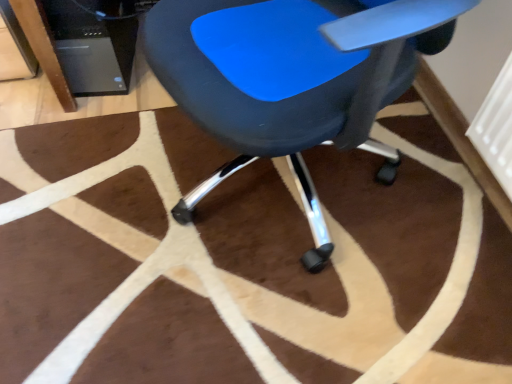
Find the location of a particular element. The height and width of the screenshot is (384, 512). blue plastic chair at center is located at coordinates (274, 86).

Identify the location of black plastic computer tower at upper left. The width and height of the screenshot is (512, 384). (x=94, y=43).

I want to click on blue plastic chair at center, so click(274, 86).

Which object is closer to the camera, black plastic computer tower at upper left or blue plastic chair at center?

blue plastic chair at center is more forward.

Which of these two, black plastic computer tower at upper left or blue plastic chair at center, is smaller?

black plastic computer tower at upper left is smaller.

From a real-world perspective, between black plastic computer tower at upper left and blue plastic chair at center, who is vertically lower?

black plastic computer tower at upper left is physically lower.

Looking at this image, are black plastic computer tower at upper left and blue plastic chair at center far apart?

No, there isn't a large distance between black plastic computer tower at upper left and blue plastic chair at center.

Is blue plastic chair at center surrounding black plastic computer tower at upper left?

No, black plastic computer tower at upper left is not surrounded by blue plastic chair at center.

Identify the location of chair on the right of black plastic computer tower at upper left. (274, 86).

From the image's perspective, is blue plastic chair at center located above black plastic computer tower at upper left?

No, from the image's perspective, blue plastic chair at center is not above black plastic computer tower at upper left.

Based on the photo, which is behind, blue plastic chair at center or black plastic computer tower at upper left?

black plastic computer tower at upper left.

Is brown fuzzy rug at center turned away from black plastic computer tower at upper left?

No, black plastic computer tower at upper left is not at the back of brown fuzzy rug at center.

Which is correct: brown fuzzy rug at center is inside black plastic computer tower at upper left, or outside of it?

brown fuzzy rug at center is outside black plastic computer tower at upper left.

This screenshot has height=384, width=512. What are the coordinates of `mat located in front of the black plastic computer tower at upper left` in the screenshot? It's located at (223, 262).

Does point (199, 58) appear closer or farther from the camera than point (19, 199)?

Point (199, 58) is positioned closer to the camera compared to point (19, 199).

This screenshot has height=384, width=512. There is a brown fuzzy rug at center. Find the location of `chair above it (from a real-world perspective)`. chair above it (from a real-world perspective) is located at coordinates (274, 86).

From a real-world perspective, is blue plastic chair at center located higher than brown fuzzy rug at center?

Yes, from a real-world perspective, blue plastic chair at center is over brown fuzzy rug at center

Which of these two, blue plastic chair at center or brown fuzzy rug at center, stands taller?

With more height is blue plastic chair at center.

Who is bigger, brown fuzzy rug at center or blue plastic chair at center?

blue plastic chair at center is bigger.

Consider the image. Which is correct: brown fuzzy rug at center is inside blue plastic chair at center, or outside of it?

brown fuzzy rug at center cannot be found inside blue plastic chair at center.

Is brown fuzzy rug at center turned away from blue plastic chair at center?

No, blue plastic chair at center is not at the back of brown fuzzy rug at center.

Looking at this image, does brown fuzzy rug at center appear on the left side of blue plastic chair at center?

Correct, you'll find brown fuzzy rug at center to the left of blue plastic chair at center.

Which of these two, black plastic computer tower at upper left or brown fuzzy rug at center, is wider?

With larger width is brown fuzzy rug at center.

Could you tell me if black plastic computer tower at upper left is facing brown fuzzy rug at center?

No.

Would you say black plastic computer tower at upper left is outside brown fuzzy rug at center?

black plastic computer tower at upper left lies outside brown fuzzy rug at center's area.

You are a GUI agent. You are given a task and a screenshot of the screen. Output one action in this format:
    pyautogui.click(x=<x>, y=<y>)
    Task: Click on the chair positioned vertically above the black plastic computer tower at upper left (from a real-world perspective)
    The height and width of the screenshot is (384, 512).
    Given the screenshot: What is the action you would take?
    pyautogui.click(x=274, y=86)

Identify the location of chair on the right of black plastic computer tower at upper left. This screenshot has height=384, width=512. (274, 86).

When comparing their distances from black plastic computer tower at upper left, does blue plastic chair at center or brown fuzzy rug at center seem further?

blue plastic chair at center is further to black plastic computer tower at upper left.

Estimate the real-world distances between objects in this image. Which object is closer to blue plastic chair at center, brown fuzzy rug at center or black plastic computer tower at upper left?

brown fuzzy rug at center is closer to blue plastic chair at center.

Considering their positions, is blue plastic chair at center positioned further to brown fuzzy rug at center than black plastic computer tower at upper left?

black plastic computer tower at upper left lies further to brown fuzzy rug at center than the other object.

When comparing their distances from brown fuzzy rug at center, does black plastic computer tower at upper left or blue plastic chair at center seem further?

Based on the image, black plastic computer tower at upper left appears to be further to brown fuzzy rug at center.

When comparing their distances from blue plastic chair at center, does black plastic computer tower at upper left or brown fuzzy rug at center seem closer?

The object closer to blue plastic chair at center is brown fuzzy rug at center.

Which object lies further to the anchor point black plastic computer tower at upper left, brown fuzzy rug at center or blue plastic chair at center?

Based on the image, blue plastic chair at center appears to be further to black plastic computer tower at upper left.

Find the location of a particular element. This screenshot has width=512, height=384. mat located between blue plastic chair at center and black plastic computer tower at upper left in the depth direction is located at coordinates (223, 262).